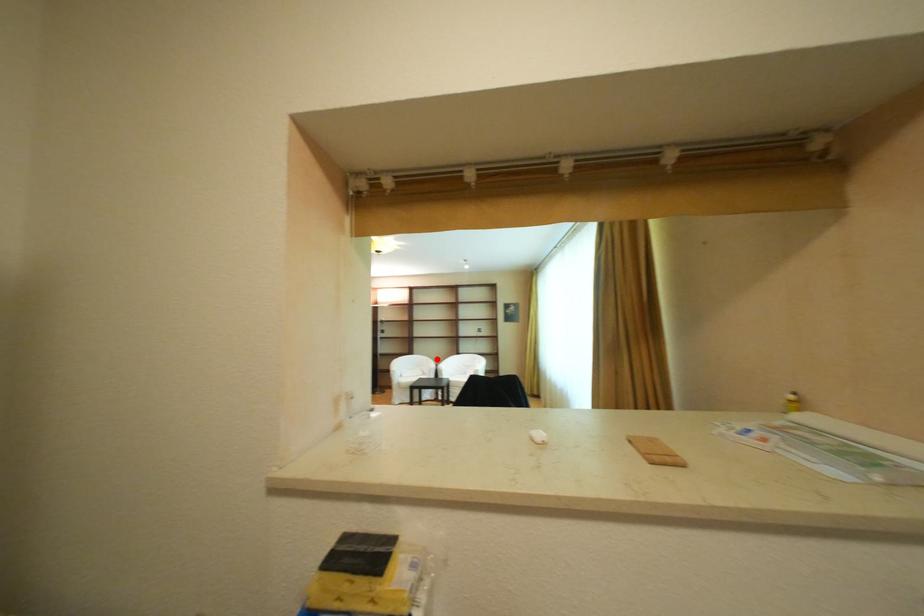
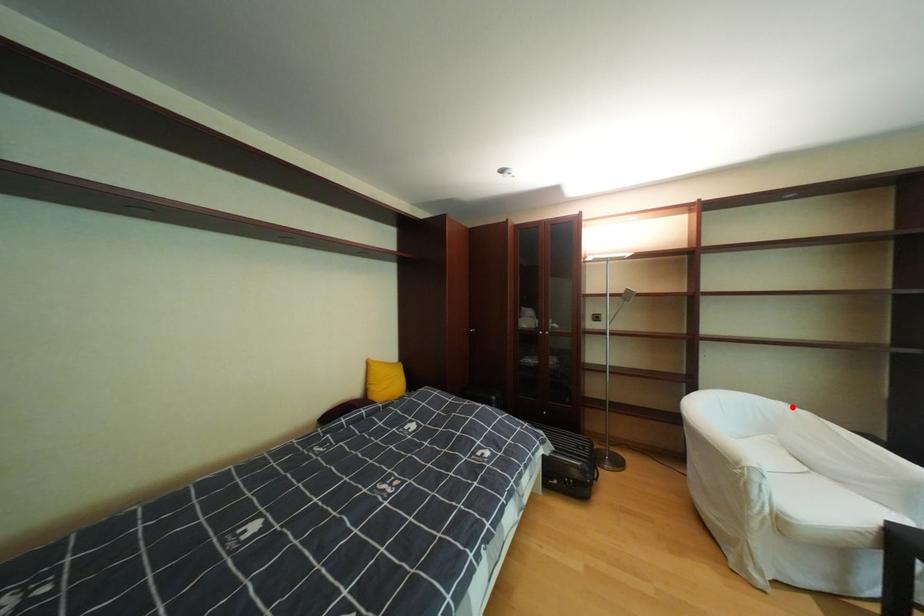
I am providing you with two images of the same scene from different viewpoints. A red point is marked on the first image and another point is marked on the second image. Is the marked point in image1 the same physical position as the marked point in image2?

Yes